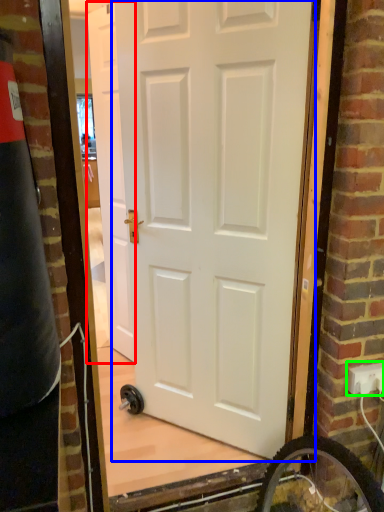
Question: Which object is positioned farthest from door (highlighted by a red box)? Select from door (highlighted by a blue box) and electric outlet (highlighted by a green box).

Choices:
 (A) door
 (B) electric outlet

Answer: (B)